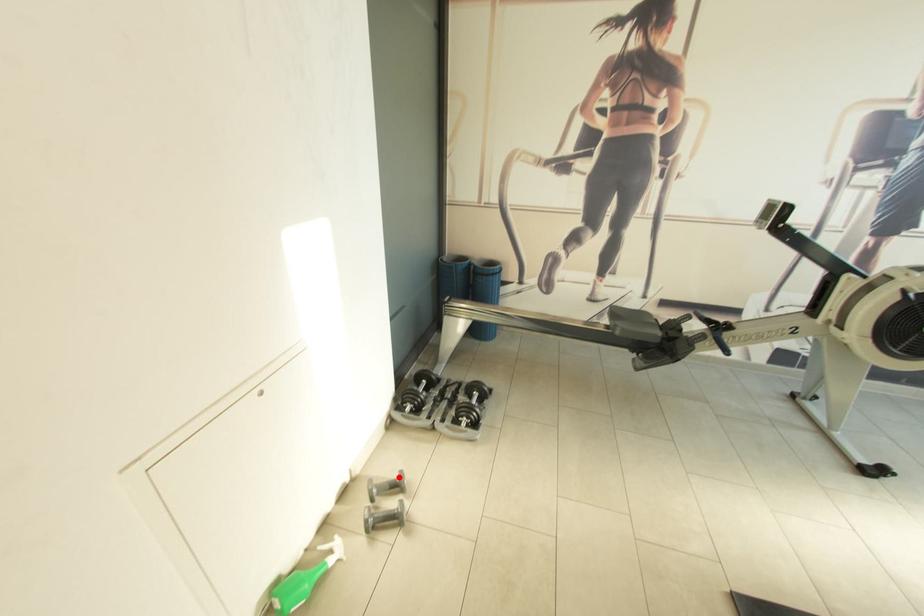
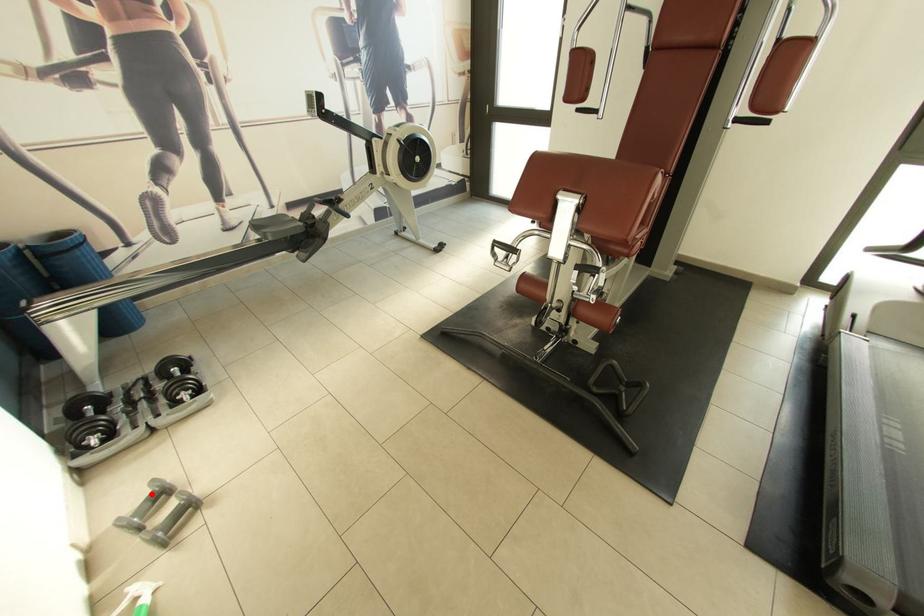
I am providing you with two images of the same scene from different viewpoints. A red point is marked on the first image and another point is marked on the second image. Do the highlighted points in image1 and image2 indicate the same real-world spot?

Yes